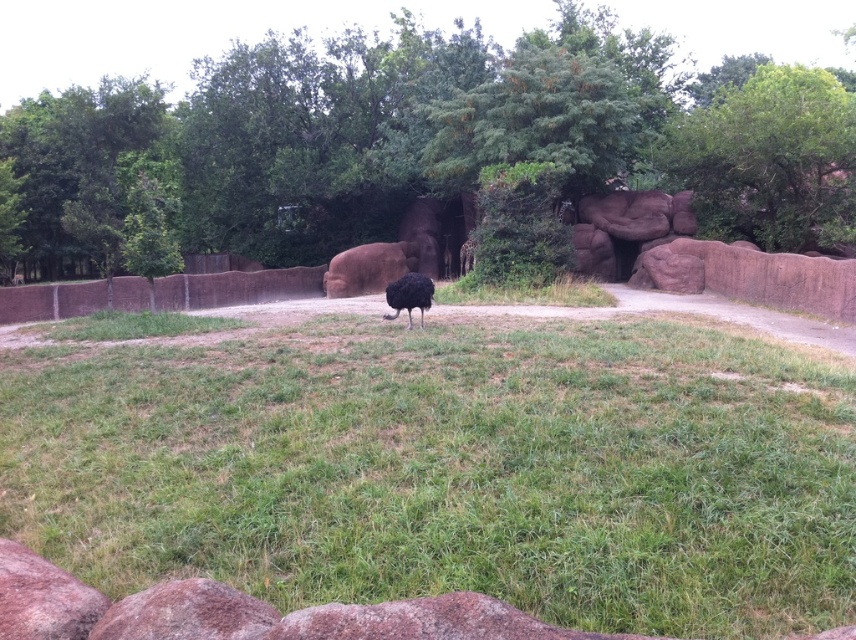
You are a zookeeper planning to plant a new shrub between the green leafy tree at center and the brown rough stone at lower left. Based on the scene, which object should you place the shrub closer to in order to ensure it has enough space to grow without overcrowding?

The green leafy tree at center might be wider than brown rough stone at lower left, so you should place the shrub closer to the brown rough stone at lower left to avoid overcrowding.

You are a zookeeper who needs to place a new feeding station between the green leafy tree at center and the brown rough stone at lower left. Based on their positions, which object should the feeding station be closer to?

The green leafy tree at center is positioned on the left side of brown rough stone at lower left, so the feeding station should be placed closer to the brown rough stone at lower left since it is on the right side of the tree.

You are a zookeeper who needs to place a small feeding tray between the smooth brown rock at lower center and the brown rough stone at lower left. Considering their widths, which rock should the tray be placed closer to ensure it fits better?

The smooth brown rock at lower center has a greater width than the brown rough stone at lower left. Therefore, placing the feeding tray closer to the smooth brown rock at lower center would allow for better fit due to its larger size.